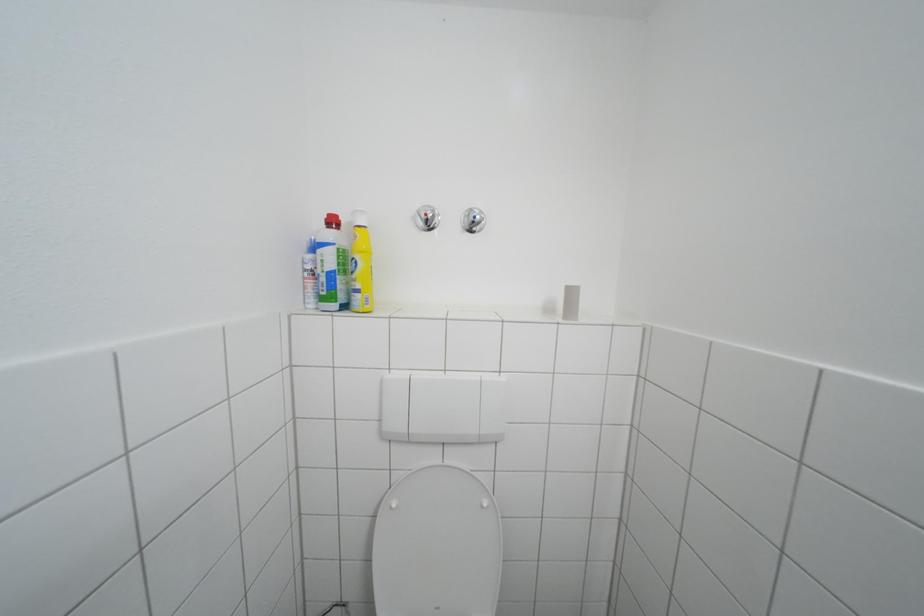
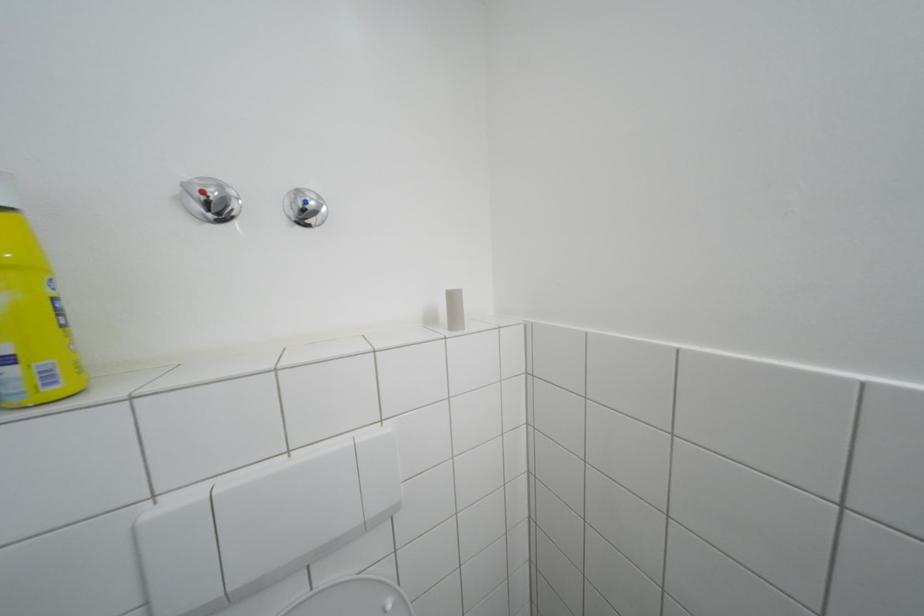
Question: The images are taken continuously from a first-person perspective. In which direction are you moving?

Choices:
 (A) Left
 (B) Right
 (C) Forward
 (D) Backward

Answer: (C)